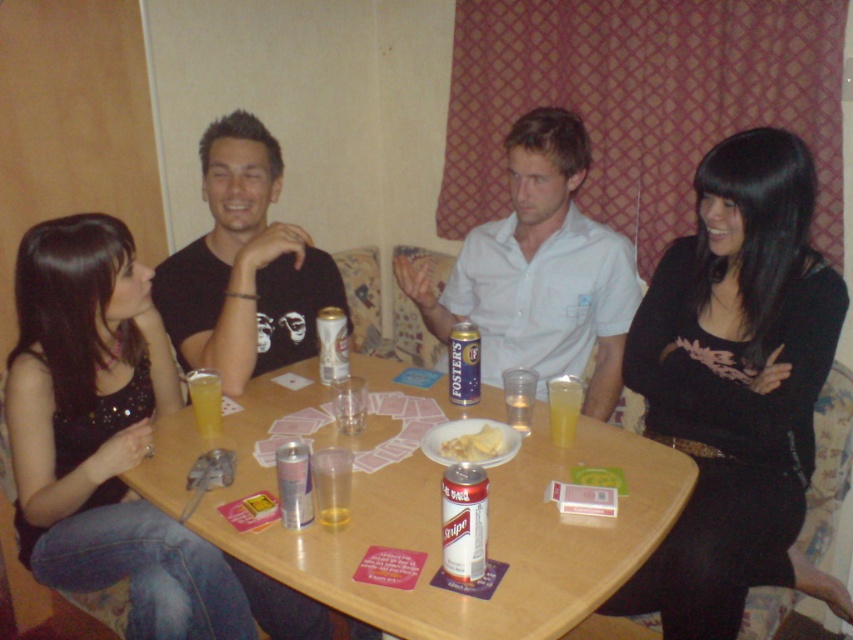
Question: Which of these objects is positioned closest to the black matte shirt at center?

Choices:
 (A) white matte can at center
 (B) yellow crumbly cheese at center

Answer: (B)

Question: Where is black matte dress at lower right located in relation to gold foil can at table center in the image?

Choices:
 (A) below
 (B) above

Answer: (A)

Question: Does wooden table at center appear on the left side of black matte shirt at center?

Choices:
 (A) no
 (B) yes

Answer: (A)

Question: Which point is closer to the camera?

Choices:
 (A) black matte shirt at center
 (B) black matte dress at lower right
 (C) gold foil can at table center

Answer: (B)

Question: Among these points, which one is farthest from the camera?

Choices:
 (A) (712, 627)
 (B) (471, 445)
 (C) (328, 316)
 (D) (463, 257)

Answer: (D)

Question: Is gold foil can at table center further to camera compared to yellow translucent plastic cup at table center?

Choices:
 (A) yes
 (B) no

Answer: (A)